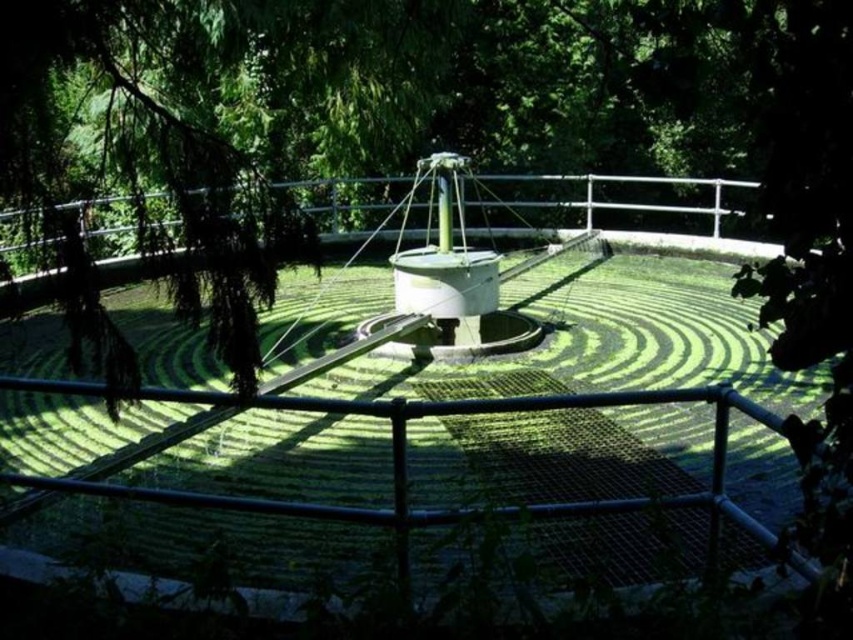
Who is more forward, (555, 406) or (631, 202)?

Point (555, 406) is in front.

Based on the photo, can you confirm if green grass at center is positioned below metallic silver rail at center?

Yes.

Where is `green grass at center`? The width and height of the screenshot is (853, 640). green grass at center is located at coordinates (444, 416).

In order to click on green grass at center in this screenshot , I will do `click(444, 416)`.